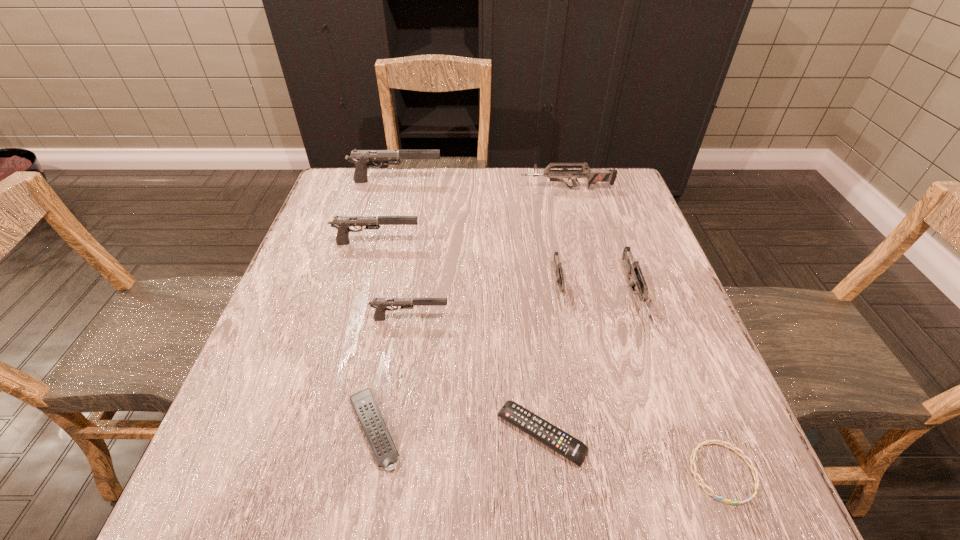
The image size is (960, 540). What are the coordinates of `free space located 0.110m aimed along the barrel of the shortest gun` in the screenshot? It's located at (572, 357).

I want to click on blank space located 0.130m on the right of the left remote control, so click(x=481, y=429).

Find the location of a particular element. The height and width of the screenshot is (540, 960). vacant space situated on the back of the right remote control is located at coordinates (525, 287).

Find the location of a particular element. bracelet that is at the near edge is located at coordinates (722, 443).

The width and height of the screenshot is (960, 540). In order to click on bracelet that is at the right edge in this screenshot , I will do `click(722, 443)`.

Image resolution: width=960 pixels, height=540 pixels. Identify the location of object located at the far left corner. 361,158.

This screenshot has width=960, height=540. I want to click on object that is at the far right corner, so click(x=593, y=176).

Where is `object at the near right corner`? object at the near right corner is located at coordinates (722, 443).

The height and width of the screenshot is (540, 960). Find the location of `vacant space at the far edge of the desktop`. vacant space at the far edge of the desktop is located at coordinates (410, 204).

Where is `free space at the near edge`? Image resolution: width=960 pixels, height=540 pixels. free space at the near edge is located at coordinates (425, 521).